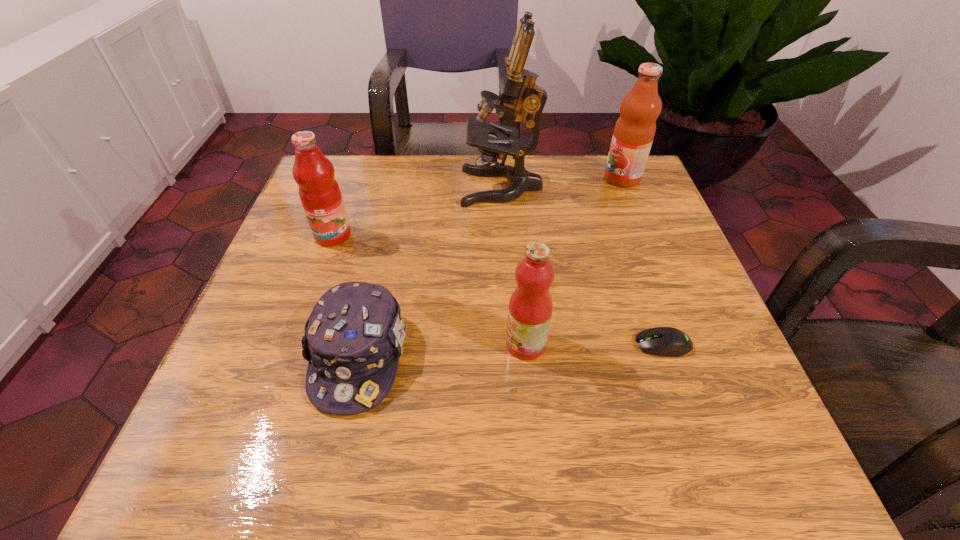
Where is `vacant region between the fifth tallest object and the nearest fruit juice`? This screenshot has height=540, width=960. vacant region between the fifth tallest object and the nearest fruit juice is located at coordinates (443, 350).

This screenshot has height=540, width=960. What are the coordinates of `free space between the nearest fruit juice and the leftmost fruit juice` in the screenshot? It's located at (429, 290).

Point out which object is positioned as the second nearest to the second fruit juice from right to left. Please provide its 2D coordinates. Your answer should be formatted as a tuple, i.e. [(x, y)], where the tuple contains the x and y coordinates of a point satisfying the conditions above.

[(353, 339)]

Identify which object is the fifth nearest to the leftmost fruit juice. Please provide its 2D coordinates. Your answer should be formatted as a tuple, i.e. [(x, y)], where the tuple contains the x and y coordinates of a point satisfying the conditions above.

[(634, 131)]

The width and height of the screenshot is (960, 540). Find the location of `fruit juice identified as the second closest to the farthest fruit juice`. fruit juice identified as the second closest to the farthest fruit juice is located at coordinates (319, 192).

Where is `fruit juice that can be found as the second closest to the shortest object`? fruit juice that can be found as the second closest to the shortest object is located at coordinates (634, 131).

Where is `free location that satisfies the following two spatial constraints: 1. at the eyepieces of the tallest object; 2. on the front-facing side of the second shortest object`? The height and width of the screenshot is (540, 960). free location that satisfies the following two spatial constraints: 1. at the eyepieces of the tallest object; 2. on the front-facing side of the second shortest object is located at coordinates (512, 356).

The image size is (960, 540). Identify the location of free location that satisfies the following two spatial constraints: 1. on the wheel side of the computer mouse; 2. on the front-facing side of the fifth tallest object. (666, 356).